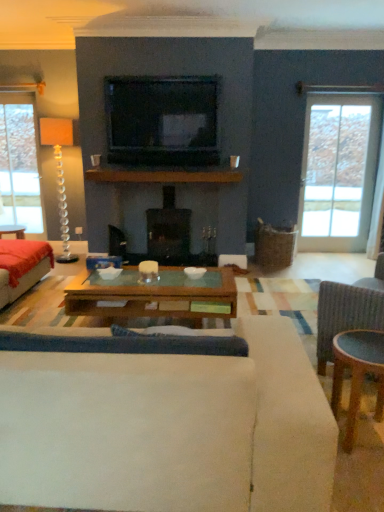
Question: From a real-world perspective, is wooden glass coffee table at center physically below black glossy television at upper center?

Choices:
 (A) yes
 (B) no

Answer: (A)

Question: Is wooden glass coffee table at center next to black glossy television at upper center?

Choices:
 (A) yes
 (B) no

Answer: (B)

Question: Is wooden glass coffee table at center shorter than black glossy television at upper center?

Choices:
 (A) no
 (B) yes

Answer: (B)

Question: Can you confirm if wooden glass coffee table at center is smaller than black glossy television at upper center?

Choices:
 (A) no
 (B) yes

Answer: (B)

Question: Is wooden glass coffee table at center oriented away from black glossy television at upper center?

Choices:
 (A) yes
 (B) no

Answer: (B)

Question: From the image's perspective, relative to black glossy television at upper center, is wooden glass coffee table at center above or below?

Choices:
 (A) below
 (B) above

Answer: (A)

Question: Based on their positions, is wooden glass coffee table at center located to the left or right of black glossy television at upper center?

Choices:
 (A) left
 (B) right

Answer: (B)

Question: Is wooden glass coffee table at center in front of or behind black glossy television at upper center in the image?

Choices:
 (A) behind
 (B) front

Answer: (B)

Question: Is point (372, 358) positioned closer to the camera than point (182, 142)?

Choices:
 (A) closer
 (B) farther

Answer: (A)

Question: Based on their positions, is velvet red couch at left, the second studio couch viewed from the front, located to the left or right of clear glass door at right?

Choices:
 (A) left
 (B) right

Answer: (A)

Question: Which is correct: velvet red couch at left, the second studio couch viewed from the front, is inside clear glass door at right, or outside of it?

Choices:
 (A) inside
 (B) outside

Answer: (B)

Question: In terms of size, does velvet red couch at left, the second studio couch viewed from the front, appear bigger or smaller than clear glass door at right?

Choices:
 (A) small
 (B) big

Answer: (B)

Question: Considering the positions of velvet red couch at left, which appears as the first studio couch when viewed from the back, and clear glass door at right in the image, is velvet red couch at left, which appears as the first studio couch when viewed from the back, taller or shorter than clear glass door at right?

Choices:
 (A) short
 (B) tall

Answer: (A)

Question: Looking at their shapes, would you say velvet red couch at left, the second studio couch viewed from the front, is wider or thinner than white fabric studio couch at center, placed as the 2th studio couch when sorted from back to front?

Choices:
 (A) wide
 (B) thin

Answer: (B)

Question: From their relative heights in the image, would you say velvet red couch at left, the second studio couch viewed from the front, is taller or shorter than white fabric studio couch at center, the 1th studio couch in the right-to-left sequence?

Choices:
 (A) short
 (B) tall

Answer: (A)